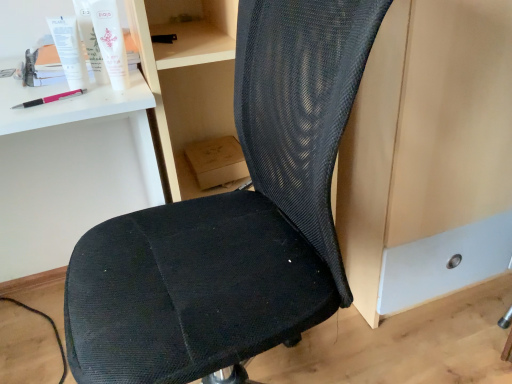
Question: Is the depth of white matte desk at upper left greater than that of pink plastic pen at upper left?

Choices:
 (A) no
 (B) yes

Answer: (A)

Question: Could you tell me if white matte desk at upper left is facing pink plastic pen at upper left?

Choices:
 (A) no
 (B) yes

Answer: (A)

Question: Is white matte desk at upper left positioned in front of pink plastic pen at upper left?

Choices:
 (A) yes
 (B) no

Answer: (A)

Question: Is white matte desk at upper left turned away from pink plastic pen at upper left?

Choices:
 (A) yes
 (B) no

Answer: (B)

Question: Does white matte desk at upper left have a larger size compared to pink plastic pen at upper left?

Choices:
 (A) no
 (B) yes

Answer: (B)

Question: Which is correct: white matte tube at upper left, the second toiletry when ordered from right to left, is inside white plastic tube at upper left, or outside of it?

Choices:
 (A) outside
 (B) inside

Answer: (A)

Question: From the image's perspective, is white matte tube at upper left, the second toiletry when ordered from right to left, above or below white plastic tube at upper left?

Choices:
 (A) below
 (B) above

Answer: (B)

Question: Considering their positions, is white matte tube at upper left, which is counted as the first toiletry, starting from the left, located in front of or behind white plastic tube at upper left?

Choices:
 (A) behind
 (B) front

Answer: (A)

Question: Considering the relative positions of white matte tube at upper left, the second toiletry when ordered from right to left, and white plastic tube at upper left in the image provided, is white matte tube at upper left, the second toiletry when ordered from right to left, to the left or to the right of white plastic tube at upper left?

Choices:
 (A) left
 (B) right

Answer: (B)

Question: From a real-world perspective, is white matte tube at upper left, which ranks as the 1th toiletry in right-to-left order, positioned above or below white matte desk at upper left?

Choices:
 (A) below
 (B) above

Answer: (B)

Question: Relative to white matte desk at upper left, is white matte tube at upper left, which ranks as the 1th toiletry in right-to-left order, in front or behind?

Choices:
 (A) front
 (B) behind

Answer: (B)

Question: Looking at their shapes, would you say white matte tube at upper left, the second toiletry viewed from the left, is wider or thinner than white matte desk at upper left?

Choices:
 (A) wide
 (B) thin

Answer: (B)

Question: Would you say white matte tube at upper left, the second toiletry viewed from the left, is to the left or to the right of white matte desk at upper left in the picture?

Choices:
 (A) right
 (B) left

Answer: (A)

Question: Is pink plastic pen at upper left in front of or behind white matte desk at upper left in the image?

Choices:
 (A) behind
 (B) front

Answer: (A)

Question: Would you say pink plastic pen at upper left is inside or outside white matte desk at upper left?

Choices:
 (A) outside
 (B) inside

Answer: (B)